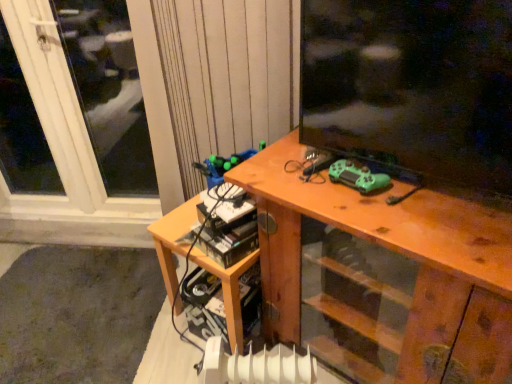
Question: Is white plastic radiator at lower center located within wooden table at lower left?

Choices:
 (A) yes
 (B) no

Answer: (B)

Question: Can you confirm if wooden table at lower left is positioned to the left of white plastic radiator at lower center?

Choices:
 (A) yes
 (B) no

Answer: (A)

Question: Is wooden table at lower left not close to white plastic radiator at lower center?

Choices:
 (A) yes
 (B) no

Answer: (B)

Question: Is wooden table at lower left at the right side of white plastic radiator at lower center?

Choices:
 (A) no
 (B) yes

Answer: (A)

Question: Considering the relative sizes of wooden table at lower left and white plastic radiator at lower center in the image provided, is wooden table at lower left bigger than white plastic radiator at lower center?

Choices:
 (A) no
 (B) yes

Answer: (B)

Question: Is wooden table at lower left smaller than white plastic radiator at lower center?

Choices:
 (A) yes
 (B) no

Answer: (B)

Question: Is white plastic radiator at lower center at the back of wooden desk at center?

Choices:
 (A) no
 (B) yes

Answer: (A)

Question: Is wooden desk at center bigger than white plastic radiator at lower center?

Choices:
 (A) no
 (B) yes

Answer: (B)

Question: Considering the relative sizes of wooden desk at center and white plastic radiator at lower center in the image provided, is wooden desk at center shorter than white plastic radiator at lower center?

Choices:
 (A) no
 (B) yes

Answer: (A)

Question: From a real-world perspective, does wooden desk at center sit lower than white plastic radiator at lower center?

Choices:
 (A) no
 (B) yes

Answer: (A)

Question: Can we say wooden desk at center lies outside white plastic radiator at lower center?

Choices:
 (A) no
 (B) yes

Answer: (B)

Question: Is white plastic radiator at lower center completely or partially inside wooden desk at center?

Choices:
 (A) no
 (B) yes

Answer: (A)

Question: Is wooden desk at center thinner than white plastic window at upper left?

Choices:
 (A) no
 (B) yes

Answer: (A)